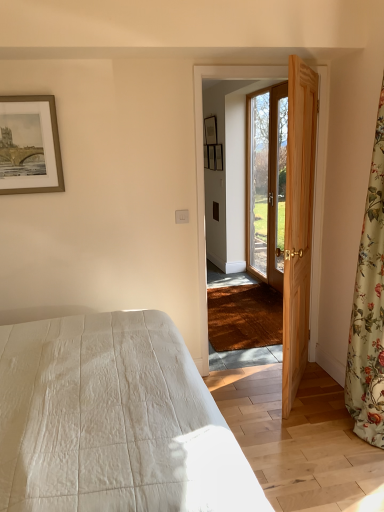
Question: Is white quilted bed at lower left placed right next to wooden picture frame at center, which ranks as the 4th picture frame in front-to-back order?

Choices:
 (A) no
 (B) yes

Answer: (A)

Question: Can you confirm if white quilted bed at lower left is bigger than wooden picture frame at center, marked as the 3th picture frame in a bottom-to-top arrangement?

Choices:
 (A) yes
 (B) no

Answer: (A)

Question: Is white quilted bed at lower left in front of wooden picture frame at center, the 2th picture frame when ordered from top to bottom?

Choices:
 (A) no
 (B) yes

Answer: (B)

Question: Is white quilted bed at lower left at the left side of wooden picture frame at center, which ranks as the 4th picture frame in front-to-back order?

Choices:
 (A) yes
 (B) no

Answer: (A)

Question: From the image's perspective, is white quilted bed at lower left located above wooden picture frame at center, arranged as the 3th picture frame when viewed from the left?

Choices:
 (A) no
 (B) yes

Answer: (A)

Question: Is point (360, 373) positioned closer to the camera than point (253, 225)?

Choices:
 (A) farther
 (B) closer

Answer: (B)

Question: Considering the positions of floral fabric curtain at right and wooden door at right, which appears as the 1th door when viewed from the back, in the image, is floral fabric curtain at right bigger or smaller than wooden door at right, which appears as the 1th door when viewed from the back,?

Choices:
 (A) small
 (B) big

Answer: (B)

Question: Looking at their shapes, would you say floral fabric curtain at right is wider or thinner than wooden door at right, which appears as the 1th door when viewed from the back?

Choices:
 (A) thin
 (B) wide

Answer: (B)

Question: From a real-world perspective, is floral fabric curtain at right positioned above or below wooden door at right, which appears as the 1th door when viewed from the back?

Choices:
 (A) below
 (B) above

Answer: (B)

Question: From a real-world perspective, is matte wooden picture frame at upper center, acting as the 3th picture frame starting from the back, physically located above or below wooden picture frame at center, which ranks as the 4th picture frame in front-to-back order?

Choices:
 (A) below
 (B) above

Answer: (A)

Question: Is matte wooden picture frame at upper center, the first picture frame positioned from the right, bigger or smaller than wooden picture frame at center, the 1th picture frame viewed from the back?

Choices:
 (A) big
 (B) small

Answer: (A)

Question: In the image, is matte wooden picture frame at upper center, which is the second picture frame from bottom to top, positioned in front of or behind wooden picture frame at center, the 2th picture frame when ordered from top to bottom?

Choices:
 (A) front
 (B) behind

Answer: (A)

Question: Considering the positions of matte wooden picture frame at upper center, the first picture frame positioned from the right, and wooden picture frame at center, acting as the second picture frame starting from the right, in the image, is matte wooden picture frame at upper center, the first picture frame positioned from the right, wider or thinner than wooden picture frame at center, acting as the second picture frame starting from the right,?

Choices:
 (A) wide
 (B) thin

Answer: (A)

Question: From the image's perspective, relative to gold-framed artwork at upper left, arranged as the first picture frame when ordered from the bottom, is wooden door at right, which is the 2th door in front-to-back order, above or below?

Choices:
 (A) below
 (B) above

Answer: (B)

Question: Based on their sizes in the image, would you say wooden door at right, which is the 2th door in front-to-back order, is bigger or smaller than gold-framed artwork at upper left, arranged as the first picture frame when ordered from the bottom?

Choices:
 (A) big
 (B) small

Answer: (A)